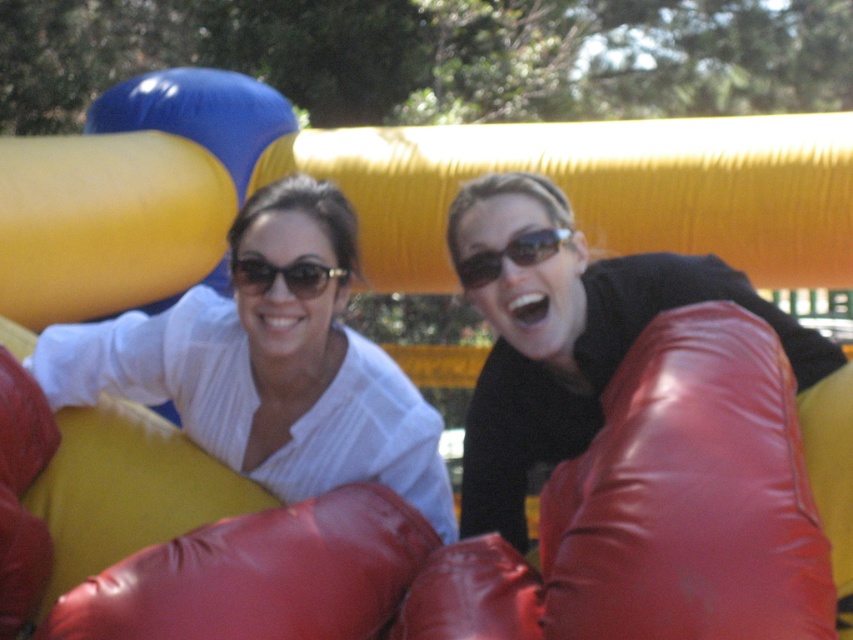
You are an observer standing in front of the inflatable structure. You notice two items at the center of the scene. Which item is taller between the matte red boxing glove at center and the matte black sunglasses at center?

The matte red boxing glove at center is taller than the matte black sunglasses at center.